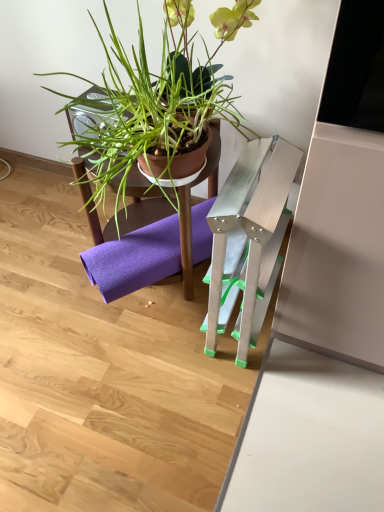
Question: From the image's perspective, does purple fabric yoga mat at lower center appear higher than brown matte plant pot at upper center?

Choices:
 (A) yes
 (B) no

Answer: (B)

Question: Is purple fabric yoga mat at lower center oriented towards brown matte plant pot at upper center?

Choices:
 (A) yes
 (B) no

Answer: (A)

Question: Does purple fabric yoga mat at lower center have a smaller size compared to brown matte plant pot at upper center?

Choices:
 (A) yes
 (B) no

Answer: (A)

Question: Is purple fabric yoga mat at lower center surrounding brown matte plant pot at upper center?

Choices:
 (A) yes
 (B) no

Answer: (B)

Question: Considering the relative sizes of purple fabric yoga mat at lower center and brown matte plant pot at upper center in the image provided, is purple fabric yoga mat at lower center bigger than brown matte plant pot at upper center?

Choices:
 (A) no
 (B) yes

Answer: (A)

Question: Is matte brown pot at center bigger or smaller than brown matte plant pot at upper center?

Choices:
 (A) big
 (B) small

Answer: (A)

Question: Considering the positions of point (104, 135) and point (76, 169), is point (104, 135) closer or farther from the camera than point (76, 169)?

Choices:
 (A) farther
 (B) closer

Answer: (B)

Question: From a real-world perspective, is matte brown pot at center above or below brown matte plant pot at upper center?

Choices:
 (A) above
 (B) below

Answer: (A)

Question: Considering the positions of matte brown pot at center and brown matte plant pot at upper center in the image, is matte brown pot at center taller or shorter than brown matte plant pot at upper center?

Choices:
 (A) short
 (B) tall

Answer: (B)

Question: Visually, is purple fabric yoga mat at lower center positioned to the left or to the right of brown matte plant pot at upper center?

Choices:
 (A) left
 (B) right

Answer: (B)

Question: Considering the positions of point (142, 280) and point (77, 158), is point (142, 280) closer or farther from the camera than point (77, 158)?

Choices:
 (A) farther
 (B) closer

Answer: (A)

Question: Which is correct: purple fabric yoga mat at lower center is inside brown matte plant pot at upper center, or outside of it?

Choices:
 (A) outside
 (B) inside

Answer: (B)

Question: Considering the positions of purple fabric yoga mat at lower center and brown matte plant pot at upper center in the image, is purple fabric yoga mat at lower center wider or thinner than brown matte plant pot at upper center?

Choices:
 (A) thin
 (B) wide

Answer: (B)

Question: From the image's perspective, is matte brown pot at center positioned above or below purple fabric yoga mat at lower center?

Choices:
 (A) above
 (B) below

Answer: (A)

Question: Considering the relative positions of matte brown pot at center and purple fabric yoga mat at lower center in the image provided, is matte brown pot at center to the left or to the right of purple fabric yoga mat at lower center?

Choices:
 (A) left
 (B) right

Answer: (A)